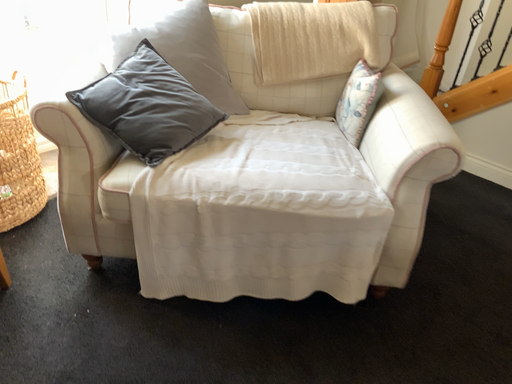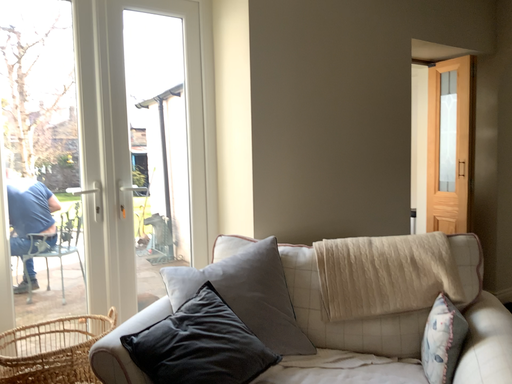
Question: How did the camera likely rotate when shooting the video?

Choices:
 (A) rotated left
 (B) rotated right

Answer: (A)